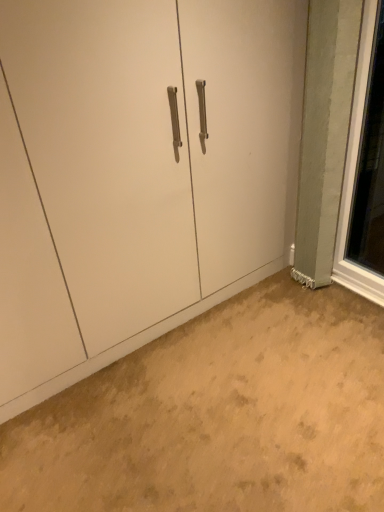
Question: From a real-world perspective, is beige carpet at lower center physically above matte white cabinet at center?

Choices:
 (A) yes
 (B) no

Answer: (B)

Question: Is beige carpet at lower center closer to camera compared to matte white cabinet at center?

Choices:
 (A) no
 (B) yes

Answer: (B)

Question: Does beige carpet at lower center have a larger size compared to matte white cabinet at center?

Choices:
 (A) no
 (B) yes

Answer: (A)

Question: Can you confirm if beige carpet at lower center is thinner than matte white cabinet at center?

Choices:
 (A) yes
 (B) no

Answer: (B)

Question: Is beige carpet at lower center not within matte white cabinet at center?

Choices:
 (A) yes
 (B) no

Answer: (A)

Question: From a real-world perspective, is beige carpet at lower center physically below matte white cabinet at center?

Choices:
 (A) yes
 (B) no

Answer: (A)

Question: Is matte white cabinet at center at the left side of beige carpet at lower center?

Choices:
 (A) no
 (B) yes

Answer: (B)

Question: Does matte white cabinet at center have a lesser width compared to beige carpet at lower center?

Choices:
 (A) no
 (B) yes

Answer: (B)

Question: Is matte white cabinet at center looking in the opposite direction of beige carpet at lower center?

Choices:
 (A) no
 (B) yes

Answer: (A)

Question: From the image's perspective, does matte white cabinet at center appear lower than beige carpet at lower center?

Choices:
 (A) yes
 (B) no

Answer: (B)

Question: Can you confirm if matte white cabinet at center is wider than beige carpet at lower center?

Choices:
 (A) no
 (B) yes

Answer: (A)

Question: Is matte white cabinet at center completely or partially outside of beige carpet at lower center?

Choices:
 (A) yes
 (B) no

Answer: (A)

Question: Is clear glass window at right outside matte white cabinet at center?

Choices:
 (A) no
 (B) yes

Answer: (B)